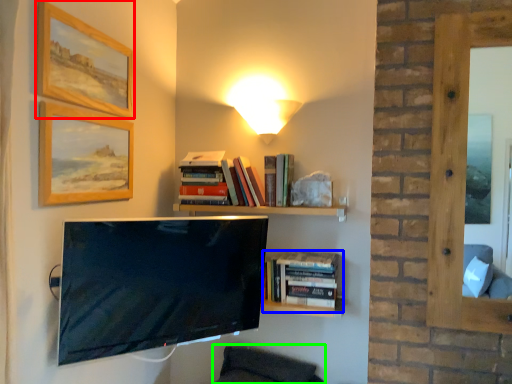
Question: Based on their relative distances, which object is nearer to picture frame (highlighted by a red box)? Choose from book (highlighted by a blue box) and swivel chair (highlighted by a green box).

Choices:
 (A) book
 (B) swivel chair

Answer: (A)